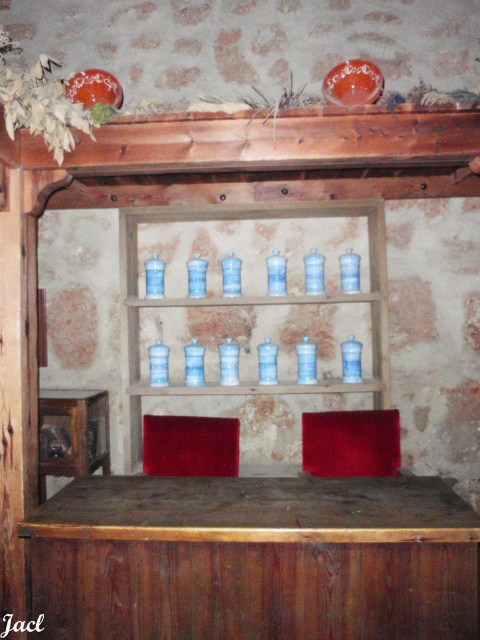
You are standing in front of the rustic wooden shelving unit. You notice two points marked on the shelves. The first point is at coordinates point [124,276] and the second is at point [320,388]. From your perspective, which point is closer to you?

Point [320,388] is closer to you because point [124,276] is behind it.

You are arranging items on a shelf and see the blue glass jars at center and the blue glass bottles at center. Which one is positioned to the left?

The blue glass jars at center are positioned to the left of the blue glass bottles at center.

You are organizing a display in the rustic wooden shelving unit. You need to place a new item between the blue glass jars at center and the blue glass bottles at center. Which direction should you move the existing items to make space?

The blue glass jars at center are located above the blue glass bottles at center. To place a new item between them, you should move the blue glass jars at center downward or the blue glass bottles at center upward to create space.